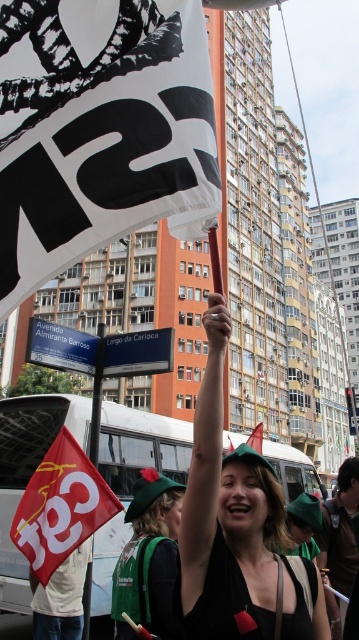
You are a photographer at the protest scene. You want to capture a photo that includes both the white paper flag at upper center and the white fabric flag at center. Which flag should you position higher in your camera frame to ensure both are visible?

To ensure both the white paper flag at upper center and the white fabric flag at center are visible in the photo, you should position the white paper flag at upper center higher in the frame since it is already located above the white fabric flag at center.

You are a photographer trying to capture both the white paper flag at upper center and the white fabric flag at center in a single shot. Which flag should you focus on first to ensure both are in frame?

The white paper flag at upper center is not as tall as the white fabric flag at center, so you should focus on the taller white fabric flag at center first to ensure both flags are captured in the frame.

You are a photographer trying to capture the protest scene. You notice two flags at the center of the image, a white paper flag at center and a white fabric flag at center. Which flag is shorter?

The white paper flag at center is shorter than the white fabric flag at center.